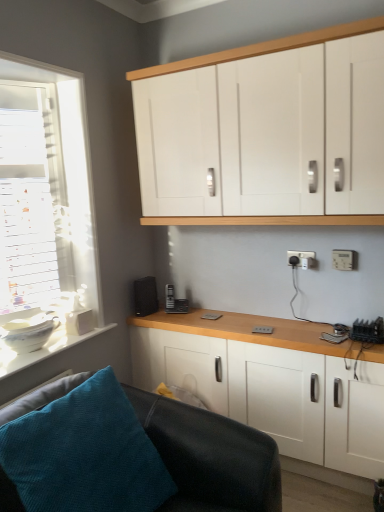
Question: Considering the positions of point (283, 330) and point (235, 500), is point (283, 330) closer or farther from the camera than point (235, 500)?

Choices:
 (A) farther
 (B) closer

Answer: (A)

Question: Considering the positions of white matte cabinet at lower center, acting as the first cabinetry starting from the bottom, and black leather couch at lower left in the image, is white matte cabinet at lower center, acting as the first cabinetry starting from the bottom, wider or thinner than black leather couch at lower left?

Choices:
 (A) thin
 (B) wide

Answer: (A)

Question: Based on their relative distances, which object is nearer to the white matte cabinet at lower center, acting as the first cabinetry starting from the bottom?

Choices:
 (A) white glossy bowl at lower left
 (B) white plastic socket at upper right, placed as the 2th electric outlet when sorted from right to left
 (C) white plastic electric outlet at lower right, the second electric outlet when ordered from back to front
 (D) black leather couch at lower left
 (E) white matte cabinet at upper center, marked as the 1th cabinetry in a top-to-bottom arrangement

Answer: (D)

Question: Estimate the real-world distances between objects in this image. Which object is closer to the white matte cabinet at lower center, the 2th cabinetry viewed from the top?

Choices:
 (A) black leather couch at lower left
 (B) white plastic electric outlet at lower right, the second electric outlet from the left
 (C) black matte speaker at lower left
 (D) white plastic socket at upper right, which appears as the first electric outlet when viewed from the back
 (E) white matte cabinet at upper center, marked as the 1th cabinetry in a top-to-bottom arrangement

Answer: (A)